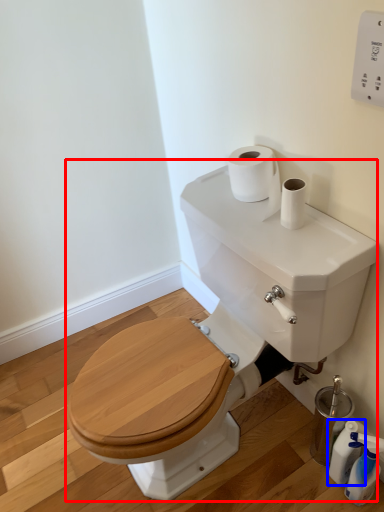
Question: Among these objects, which one is farthest to the camera, sink (highlighted by a red box) or cleaning product (highlighted by a blue box)?

Choices:
 (A) sink
 (B) cleaning product

Answer: (B)